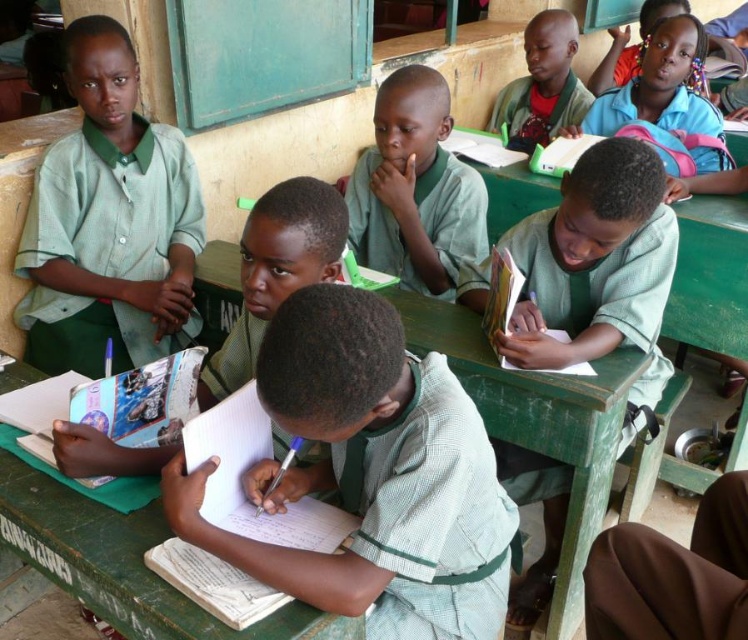
You are a teacher in the classroom and need to hand out a worksheet. The worksheet is only wide enough for a child wearing the green matte uniform at center to fit it comfortably. If you give the worksheet to the child in the green striped shirt at center, will it fit?

The green striped shirt at center might be wider than green matte uniform at center, so the worksheet may not fit comfortably if given to the child in the green striped shirt at center.

You are a teacher in the classroom and need to hand out a worksheet. The worksheet is as wide as the green wooden table at center. Can the green striped shirt at center fit the worksheet on their desk without folding it?

The green striped shirt at center has a lesser width compared to green wooden table at center. Since the worksheet is as wide as the green wooden table at center, it would be too wide for the green striped shirt at center to fit on their desk without folding it.

From the picture: You are a teacher in the classroom and you need to hand out a book to the child wearing the green striped shirt at center. The book is placed on the green wooden table at center. Can you reach the book without moving from your current position?

The green striped shirt at center is much taller than the green wooden table at center, so the child wearing the green striped shirt at center can easily reach the book on the green wooden table at center without needing to move.